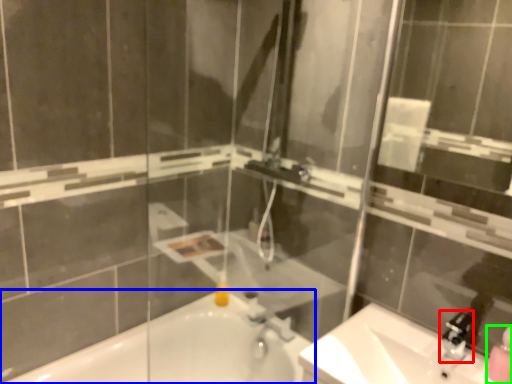
Question: Which object is the closest to the faucet (highlighted by a red box)? Choose among these: bathtub (highlighted by a blue box) or soap dispenser (highlighted by a green box).

Choices:
 (A) bathtub
 (B) soap dispenser

Answer: (B)